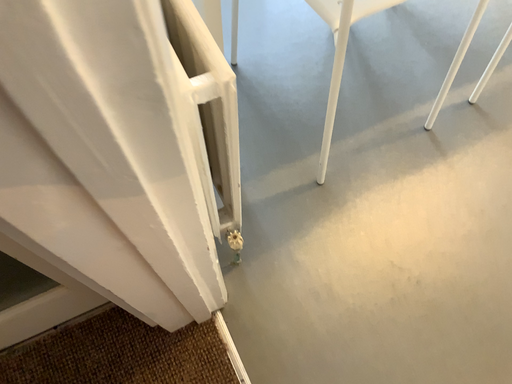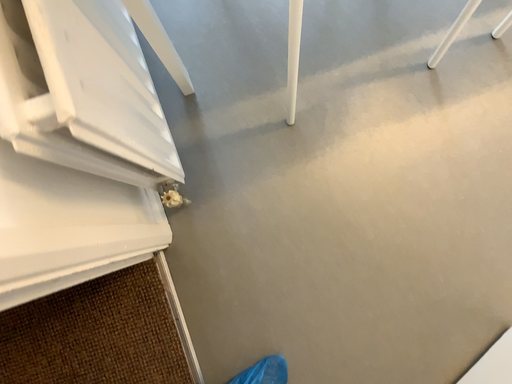
Question: Which way did the camera rotate in the video?

Choices:
 (A) rotated upward
 (B) rotated downward

Answer: (B)